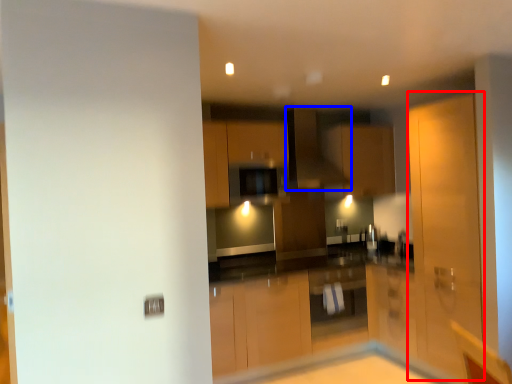
Question: Among these objects, which one is farthest to the camera, screen door (highlighted by a red box) or exhaust hood (highlighted by a blue box)?

Choices:
 (A) screen door
 (B) exhaust hood

Answer: (B)